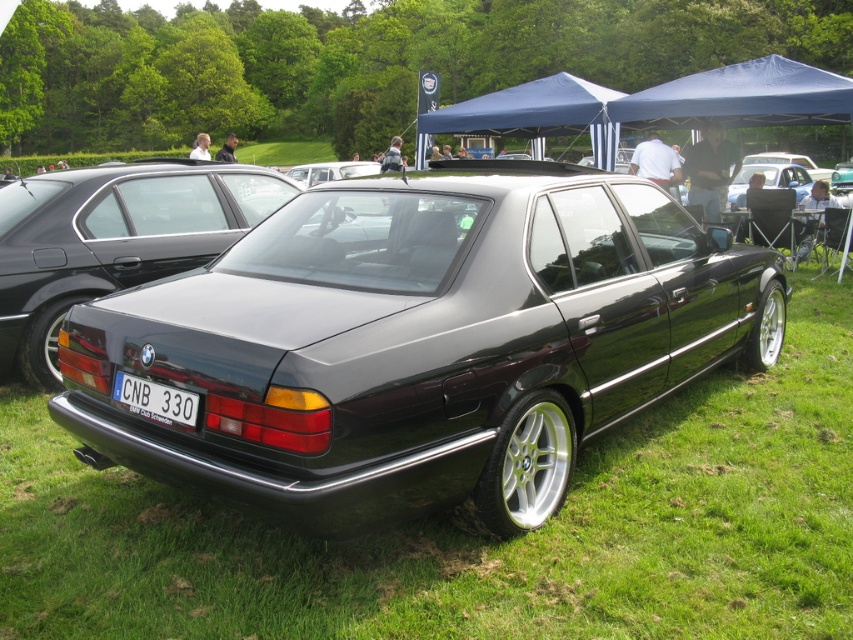
Question: Among these objects, which one is nearest to the camera?

Choices:
 (A) white plastic license plate at center
 (B) glossy black sedan at center

Answer: (B)

Question: From the image, what is the correct spatial relationship of glossy black sedan at center in relation to white plastic license plate at center?

Choices:
 (A) right
 (B) left

Answer: (A)

Question: Which of the following is the closest to the observer?

Choices:
 (A) white plastic license plate at center
 (B) glossy black sedan at center

Answer: (B)

Question: Can you confirm if glossy black sedan at center is positioned below white plastic license plate at center?

Choices:
 (A) yes
 (B) no

Answer: (B)

Question: Can you confirm if glossy black sedan at center is thinner than white plastic license plate at center?

Choices:
 (A) yes
 (B) no

Answer: (B)